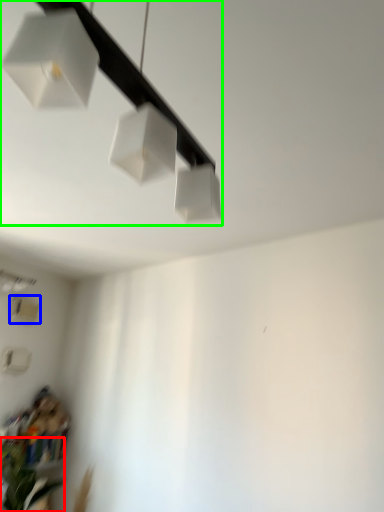
Question: Based on their relative distances, which object is nearer to plant (highlighted by a red box)? Choose from lamp (highlighted by a blue box) and lamp (highlighted by a green box).

Choices:
 (A) lamp
 (B) lamp

Answer: (A)